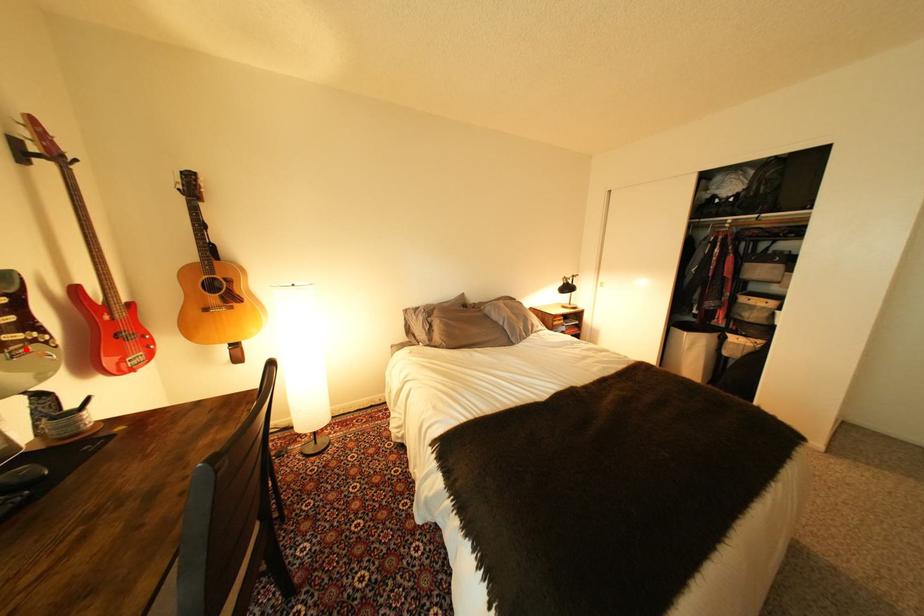
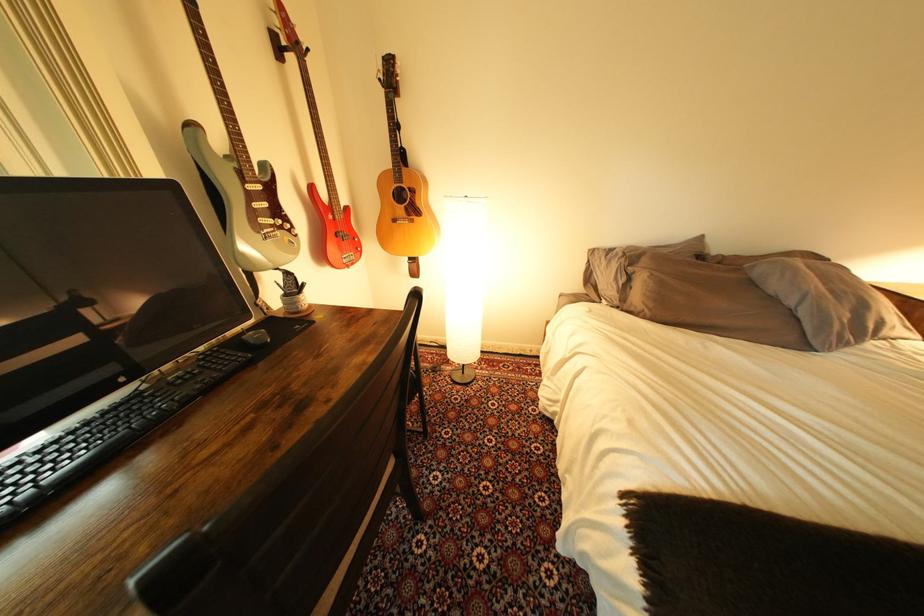
In the second image, find the point that corresponds to the highlighted location in the first image.

(278, 233)